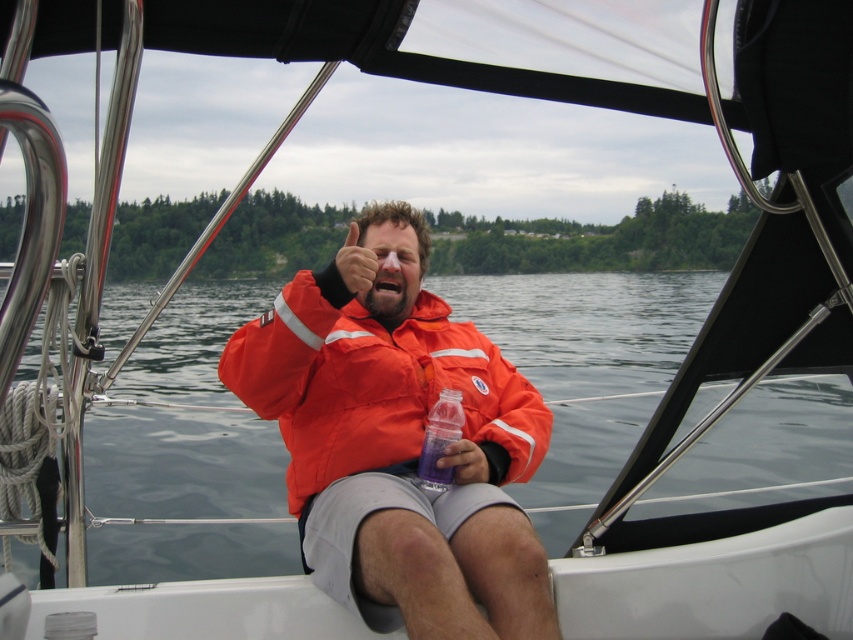
Question: Does orange fabric jacket at center appear on the right side of translucent purple bottle at center?

Choices:
 (A) no
 (B) yes

Answer: (A)

Question: Among these objects, which one is nearest to the camera?

Choices:
 (A) translucent purple bottle at center
 (B) orange fabric jacket at center

Answer: (B)

Question: Which point is farther to the camera?

Choices:
 (A) (405, 406)
 (B) (434, 406)

Answer: (A)

Question: Does orange fabric jacket at center have a smaller size compared to translucent purple bottle at center?

Choices:
 (A) no
 (B) yes

Answer: (A)

Question: Which object appears closest to the camera in this image?

Choices:
 (A) orange fabric jacket at center
 (B) translucent purple bottle at center

Answer: (A)

Question: Is orange fabric jacket at center bigger than translucent purple bottle at center?

Choices:
 (A) yes
 (B) no

Answer: (A)